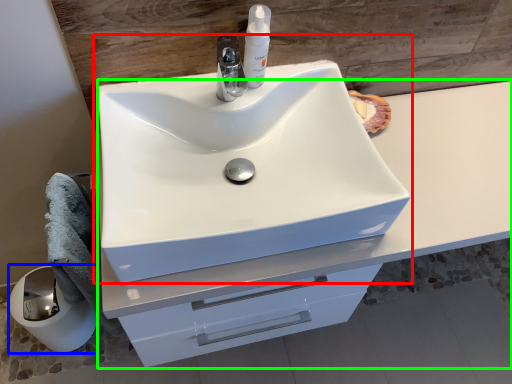
Question: Which object is positioned farthest from sink (highlighted by a red box)? Select from paper towel (highlighted by a blue box) and bathroom cabinet (highlighted by a green box).

Choices:
 (A) paper towel
 (B) bathroom cabinet

Answer: (A)